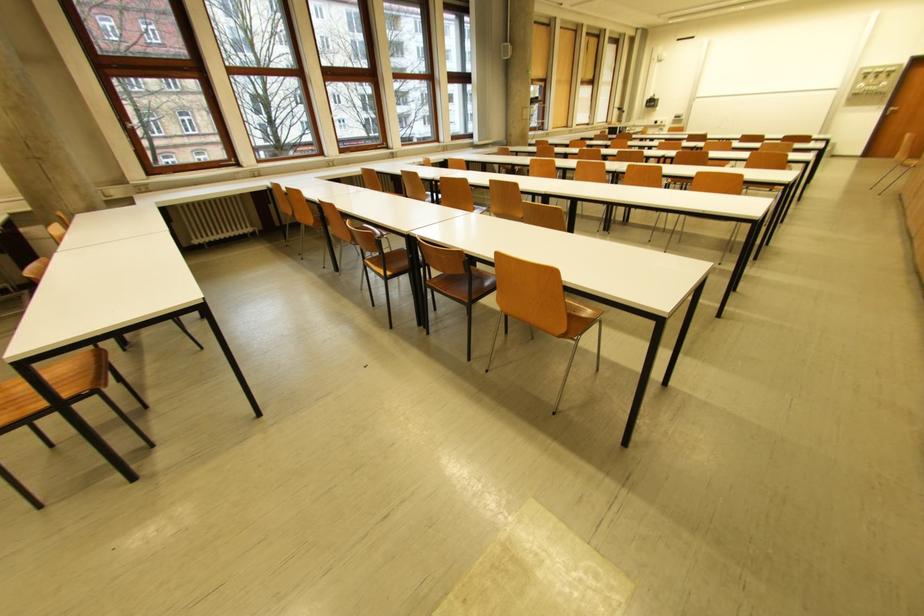
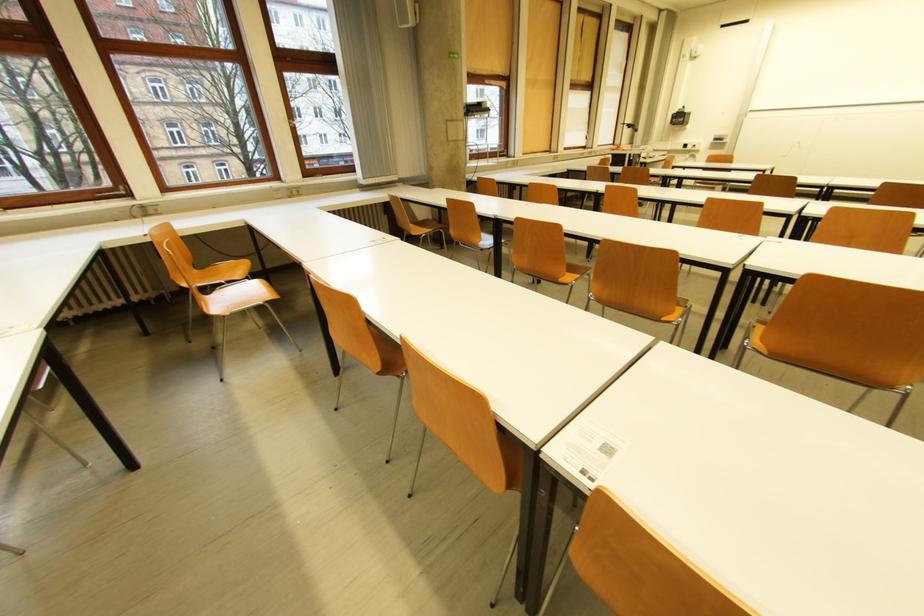
Find the pixel in the second image that matches the point at 663,123 in the first image.

(691, 147)